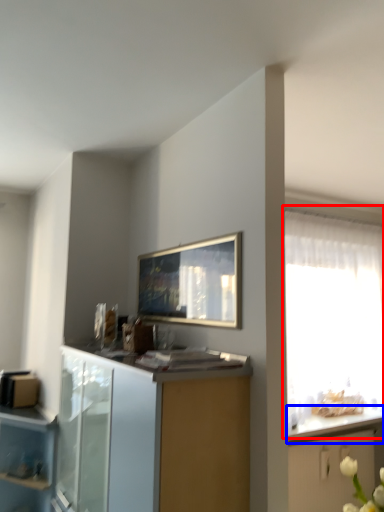
Question: Which of the following is the farthest to the observer, window (highlighted by a red box) or countertop (highlighted by a blue box)?

Choices:
 (A) window
 (B) countertop

Answer: (B)